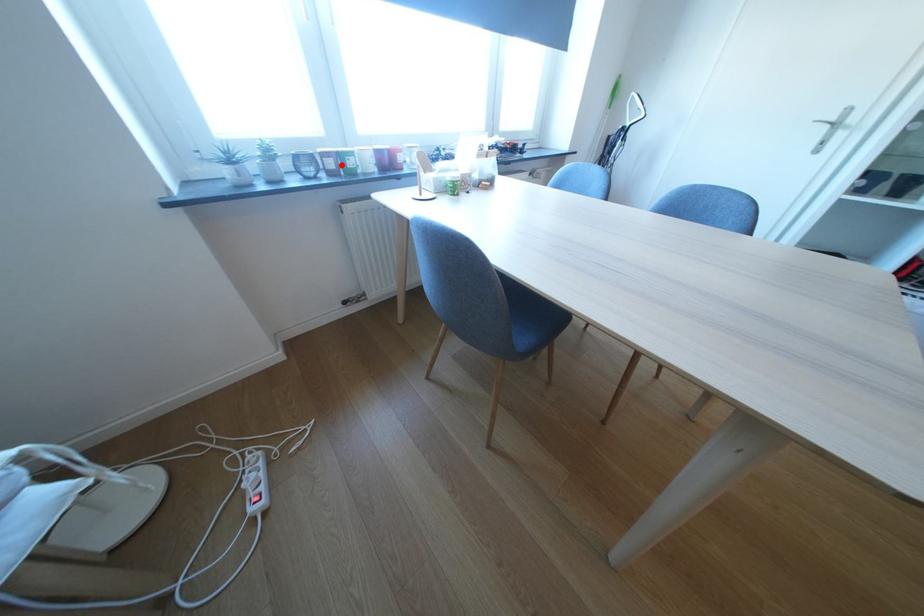
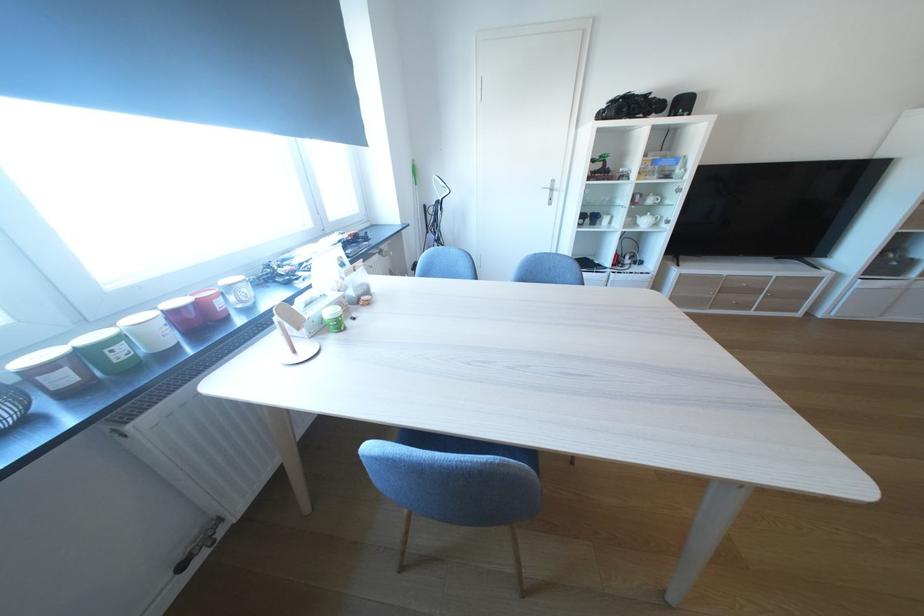
In the second image, find the point that corresponds to the highlighted location in the first image.

(75, 379)